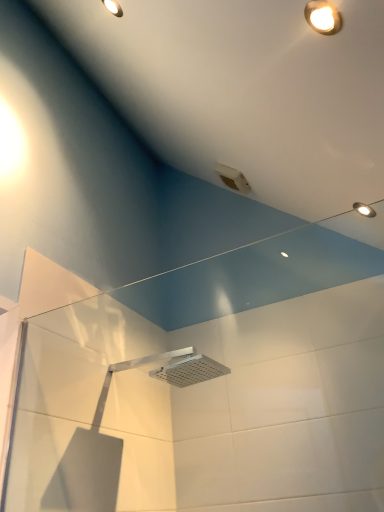
Find the location of `silver metallic shower head at center`. silver metallic shower head at center is located at coordinates (178, 367).

Measure the distance between silver metallic shower head at center and camera.

The depth of silver metallic shower head at center is 1.50 meters.

What do you see at coordinates (178, 367) in the screenshot?
I see `silver metallic shower head at center` at bounding box center [178, 367].

You are a GUI agent. You are given a task and a screenshot of the screen. Output one action in this format:
    pyautogui.click(x=<x>, y=<y>)
    Task: Click on the silver metallic shower head at center
    
    Given the screenshot: What is the action you would take?
    pyautogui.click(x=178, y=367)